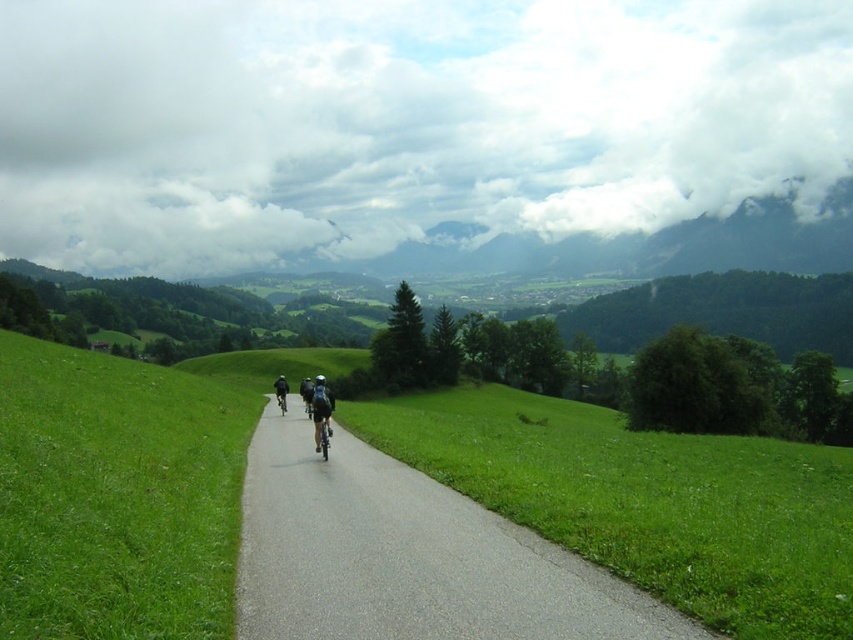
You are a cyclist approaching the path and want to know if there is enough space between the black matte bicycle at center and the shiny black bicycle at center to pass through. Can you determine this based on their positions?

The black matte bicycle at center is below the shiny black bicycle at center, meaning they are stacked vertically. Since they are not side by side, there is no horizontal space between them for passing through.